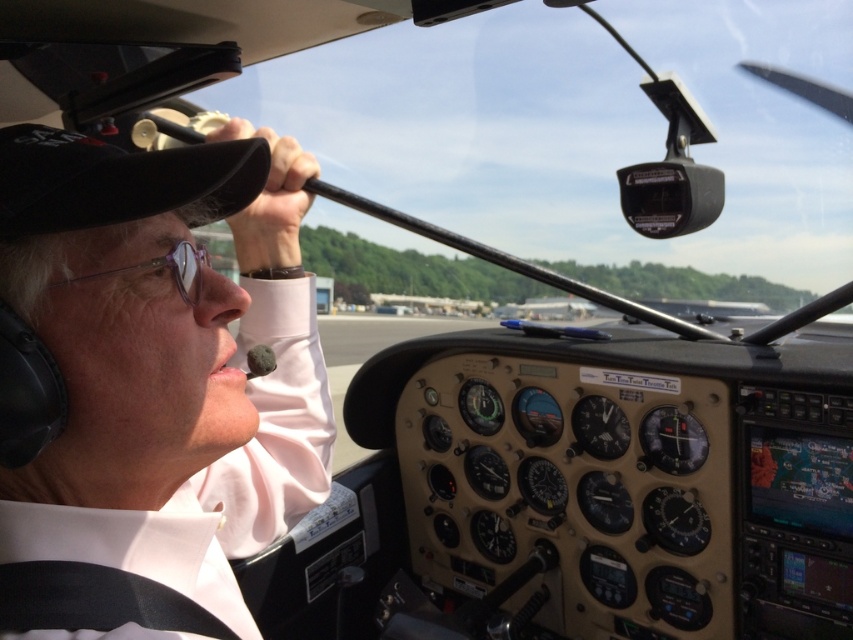
You are a flight attendant who needs to locate the matte black headset at upper left in the cockpit. According to the coordinates provided, where would you find it?

The matte black headset at upper left is located at coordinates point (173, 394).

You are a flight attendant preparing for a flight and need to check the equipment in the cockpit. You see the matte black headset at upper left and the clear plastic glasses at upper left. Which of these two items is taller?

The matte black headset at upper left is taller than the clear plastic glasses at upper left.

You are a flight attendant checking the cockpit for safety. You notice the matte black headset at upper left and the clear plastic glasses at upper left. Which object is positioned lower?

The matte black headset at upper left is below clear plastic glasses at upper left, so it is positioned lower.